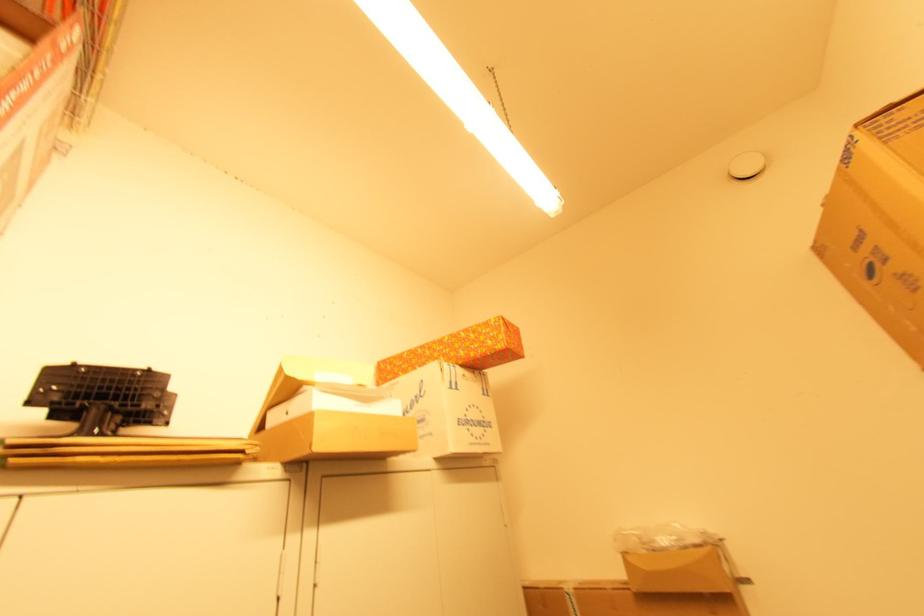
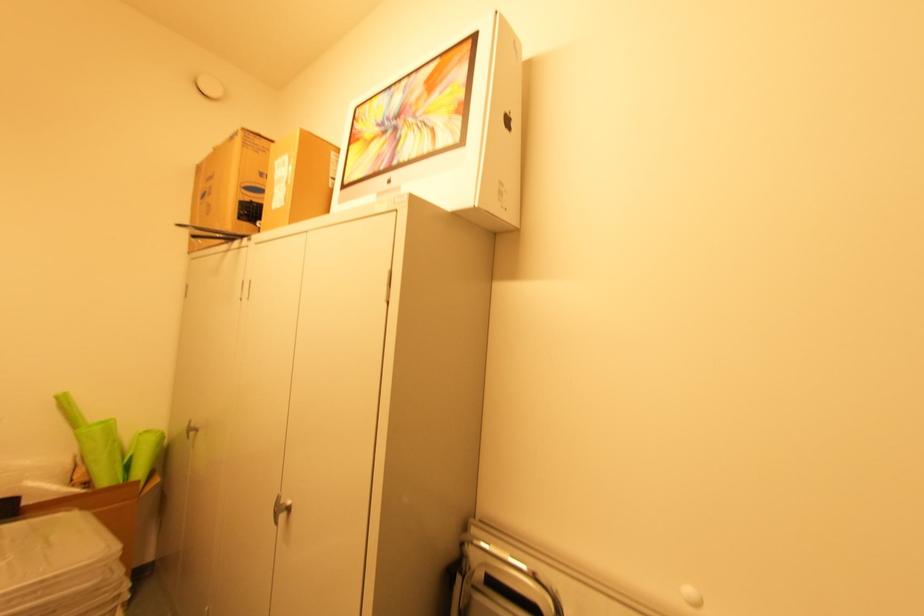
In the second image, find the point that corresponds to pixel 825 206 in the first image.

(216, 148)